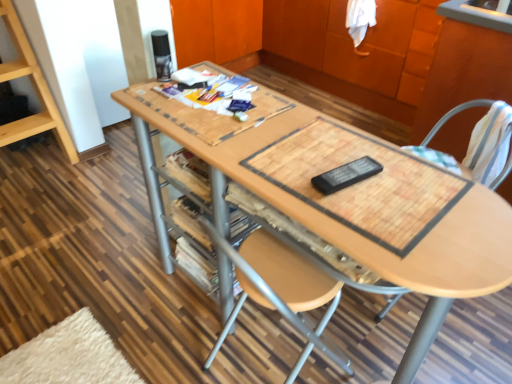
What do you see at coordinates (455, 114) in the screenshot? Image resolution: width=512 pixels, height=384 pixels. I see `white striped fabric swivel chair at right` at bounding box center [455, 114].

Locate an element on the screen. The width and height of the screenshot is (512, 384). bamboo placemat at center is located at coordinates (362, 183).

Is bamboo placemat at center shorter than wooden cabinet at upper center?

Yes.

Could you tell me if bamboo placemat at center is facing wooden cabinet at upper center?

No, bamboo placemat at center is not aimed at wooden cabinet at upper center.

From the image's perspective, is bamboo placemat at center above wooden cabinet at upper center?

Actually, bamboo placemat at center appears below wooden cabinet at upper center in the image.

In the scene shown: From a real-world perspective, between bamboo placemat at center and wooden cabinet at upper center, who is vertically higher?

bamboo placemat at center, from a real-world perspective.

From a real-world perspective, between bamboo placemat at center and wooden at right, who is vertically lower?

wooden at right is physically lower.

Identify the location of chair that is below the bamboo placemat at center (from the image's perspective). (453, 115).

Is bamboo placemat at center completely or partially outside of wooden at right?

Absolutely, bamboo placemat at center is external to wooden at right.

From the image's perspective, would you say bamboo placemat at center is positioned over wooden at right?

Yes, from the image's perspective, bamboo placemat at center is above wooden at right.

From a real-world perspective, which is physically below, wooden at right or wooden table at center?

From a 3D spatial view, wooden table at center is below.

Is wooden at right far away from wooden table at center?

That's not correct — wooden at right is a little close to wooden table at center.

From the image's perspective, would you say wooden at right is shown under wooden table at center?

No, from the image's perspective, wooden at right is not below wooden table at center.

From a real-world perspective, is white striped fabric swivel chair at right physically located above or below bamboo placemat at center?

From a real-world perspective, white striped fabric swivel chair at right is physically below bamboo placemat at center.

From the image's perspective, which is below, white striped fabric swivel chair at right or bamboo placemat at center?

bamboo placemat at center, from the image's perspective.

Which of these two, white striped fabric swivel chair at right or bamboo placemat at center, is smaller?

bamboo placemat at center is smaller.

Looking at their sizes, would you say wooden at right is wider or thinner than wooden cabinet at upper center?

wooden at right is thinner than wooden cabinet at upper center.

Is wooden at right inside or outside of wooden cabinet at upper center?

wooden at right exists outside the volume of wooden cabinet at upper center.

Is wooden at right directly adjacent to wooden cabinet at upper center?

No, wooden at right is not in contact with wooden cabinet at upper center.

Between wooden at right and wooden cabinet at upper center, which one appears on the left side from the viewer's perspective?

From the viewer's perspective, wooden at right appears more on the left side.

Is white striped fabric swivel chair at right turned away from wooden at right?

Yes.

Identify the location of chair in front of the white striped fabric swivel chair at right. (453, 115).

From a real-world perspective, is white striped fabric swivel chair at right beneath wooden at right?

No, from a real-world perspective, white striped fabric swivel chair at right is not beneath wooden at right.

How distant is white striped fabric swivel chair at right from wooden at right?

They are 0.28 inches apart.

From the image's perspective, which is above, white striped fabric swivel chair at right or wooden table at center?

white striped fabric swivel chair at right is shown above in the image.

Looking at their sizes, would you say white striped fabric swivel chair at right is wider or thinner than wooden table at center?

Clearly, white striped fabric swivel chair at right has less width compared to wooden table at center.

Is wooden table at center at the back of white striped fabric swivel chair at right?

No.

From a real-world perspective, which is physically above, white striped fabric swivel chair at right or wooden table at center?

From a 3D spatial view, white striped fabric swivel chair at right is above.

Where is `cabinetry located behind the bamboo placemat at center`? cabinetry located behind the bamboo placemat at center is located at coordinates (360, 45).

You are a GUI agent. You are given a task and a screenshot of the screen. Output one action in this format:
    pyautogui.click(x=<x>, y=<y>)
    Task: Click on the mat on the left of wooden at right
    This screenshot has width=512, height=384.
    Given the screenshot: What is the action you would take?
    pyautogui.click(x=362, y=183)

When comparing their distances from wooden at right, does white striped fabric swivel chair at right or bamboo placemat at center seem closer?

white striped fabric swivel chair at right lies closer to wooden at right than the other object.

Based on their spatial positions, is wooden table at center or wooden at right closer to white striped fabric swivel chair at right?

wooden at right is positioned closer to the anchor white striped fabric swivel chair at right.

Estimate the real-world distances between objects in this image. Which object is further from wooden table at center, wooden cabinet at upper center or bamboo placemat at center?

wooden cabinet at upper center lies further to wooden table at center than the other object.

When comparing their distances from white striped fabric swivel chair at right, does bamboo placemat at center or wooden table at center seem further?

wooden table at center.

Estimate the real-world distances between objects in this image. Which object is closer to bamboo placemat at center, white striped fabric swivel chair at right or wooden at right?

white striped fabric swivel chair at right is positioned closer to the anchor bamboo placemat at center.

Based on their spatial positions, is wooden table at center or white striped fabric swivel chair at right closer to wooden at right?

Among the two, white striped fabric swivel chair at right is located nearer to wooden at right.

Estimate the real-world distances between objects in this image. Which object is further from bamboo placemat at center, wooden at right or wooden table at center?

The object further to bamboo placemat at center is wooden at right.

From the image, which object appears to be nearer to wooden table at center, wooden at right or white striped fabric swivel chair at right?

white striped fabric swivel chair at right lies closer to wooden table at center than the other object.

This screenshot has width=512, height=384. Find the location of `chair between bamboo placemat at center and white striped fabric swivel chair at right in the horizontal direction`. chair between bamboo placemat at center and white striped fabric swivel chair at right in the horizontal direction is located at coordinates (453, 115).

Find the location of `mat located between wooden table at center and white striped fabric swivel chair at right in the left-right direction`. mat located between wooden table at center and white striped fabric swivel chair at right in the left-right direction is located at coordinates (362, 183).

The height and width of the screenshot is (384, 512). Identify the location of swivel chair between wooden cabinet at upper center and wooden at right in the up-down direction. (455, 114).

Locate an element on the screen. chair located between wooden table at center and wooden cabinet at upper center in the depth direction is located at coordinates click(453, 115).